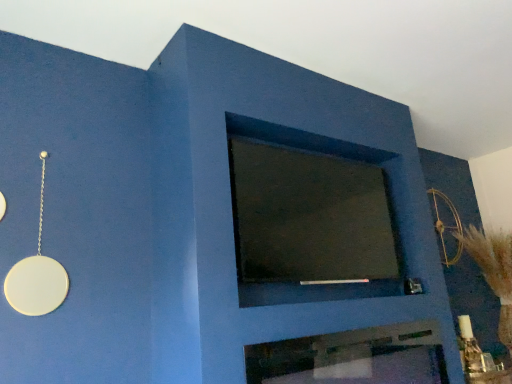
Where is `gold metallic bow at upper right`? Image resolution: width=512 pixels, height=384 pixels. gold metallic bow at upper right is located at coordinates (446, 226).

In order to click on dark matte glass at center in this screenshot , I will do `click(310, 215)`.

Considering the relative positions of dark matte glass at center and metallic silver fireplace at center in the image provided, is dark matte glass at center behind metallic silver fireplace at center?

Yes, the depth of dark matte glass at center is greater than that of metallic silver fireplace at center.

Is metallic silver fireplace at center inside dark matte glass at center?

Definitely not — metallic silver fireplace at center is not inside dark matte glass at center.

Which of these two, dark matte glass at center or metallic silver fireplace at center, stands taller?

dark matte glass at center.

From a real-world perspective, between dark matte glass at center and metallic silver fireplace at center, who is vertically lower?

→ metallic silver fireplace at center.

In the image, is gold metallic bow at upper right on the left side or the right side of dark matte glass at center?

gold metallic bow at upper right is to the right of dark matte glass at center.

Is point (444, 261) closer to camera compared to point (336, 160)?

No, (444, 261) is further to viewer.

The width and height of the screenshot is (512, 384). What are the coordinates of `circle lying on the right of dark matte glass at center` in the screenshot? It's located at 446,226.

Does gold metallic bow at upper right have a larger size compared to dark matte glass at center?

Incorrect, gold metallic bow at upper right is not larger than dark matte glass at center.

Considering the sizes of objects metallic silver fireplace at center and dark matte glass at center in the image provided, who is wider, metallic silver fireplace at center or dark matte glass at center?

dark matte glass at center.

Considering the relative sizes of metallic silver fireplace at center and dark matte glass at center in the image provided, is metallic silver fireplace at center bigger than dark matte glass at center?

Incorrect, metallic silver fireplace at center is not larger than dark matte glass at center.

From a real-world perspective, between metallic silver fireplace at center and dark matte glass at center, who is vertically higher?

In real-world perspective, dark matte glass at center is above.

Is metallic silver fireplace at center at the back of gold metallic bow at upper right?

gold metallic bow at upper right is not turned away from metallic silver fireplace at center.

Which is nearer, (454, 258) or (298, 362)?

Point (454, 258) appears to be farther away from the viewer than point (298, 362).

How many degrees apart are the facing directions of gold metallic bow at upper right and metallic silver fireplace at center?

They differ by 0.0192 degrees in their facing directions.

From a real-world perspective, is gold metallic bow at upper right below metallic silver fireplace at center?

No, from a real-world perspective, gold metallic bow at upper right is not beneath metallic silver fireplace at center.

Considering the points (341, 225) and (451, 228), which point is in front, point (341, 225) or point (451, 228)?

Positioned in front is point (341, 225).

What's the angular difference between dark matte glass at center and gold metallic bow at upper right's facing directions?

0.357 degrees separate the facing orientations of dark matte glass at center and gold metallic bow at upper right.

From the image's perspective, is dark matte glass at center beneath gold metallic bow at upper right?

No, from the image's perspective, dark matte glass at center is not beneath gold metallic bow at upper right.

The height and width of the screenshot is (384, 512). In the image, there is a gold metallic bow at upper right. Identify the location of fireplace below it (from the image's perspective). (353, 357).

Is gold metallic bow at upper right a part of metallic silver fireplace at center?

No, gold metallic bow at upper right is not a part of metallic silver fireplace at center.

How many degrees apart are the facing directions of metallic silver fireplace at center and gold metallic bow at upper right?

0.0192 degrees.

Who is more distant, metallic silver fireplace at center or gold metallic bow at upper right?

gold metallic bow at upper right is more distant.

Where is `fireplace that is in front of the dark matte glass at center`? fireplace that is in front of the dark matte glass at center is located at coordinates (353, 357).

Image resolution: width=512 pixels, height=384 pixels. In the image, there is a gold metallic bow at upper right. What are the coordinates of `window above it (from the image's perspective)` in the screenshot? It's located at (310, 215).

Consider the image. Which object lies further to the anchor point dark matte glass at center, gold metallic bow at upper right or metallic silver fireplace at center?

gold metallic bow at upper right is positioned further to the anchor dark matte glass at center.

From the image, which object appears to be nearer to metallic silver fireplace at center, dark matte glass at center or gold metallic bow at upper right?

Based on the image, dark matte glass at center appears to be nearer to metallic silver fireplace at center.

Which object lies further to the anchor point metallic silver fireplace at center, gold metallic bow at upper right or dark matte glass at center?

Among the two, gold metallic bow at upper right is located further to metallic silver fireplace at center.

Looking at the image, which one is located closer to gold metallic bow at upper right, dark matte glass at center or metallic silver fireplace at center?

The object closer to gold metallic bow at upper right is dark matte glass at center.

Which object lies further to the anchor point gold metallic bow at upper right, metallic silver fireplace at center or dark matte glass at center?

The object further to gold metallic bow at upper right is metallic silver fireplace at center.

When comparing their distances from dark matte glass at center, does metallic silver fireplace at center or gold metallic bow at upper right seem further?

Based on the image, gold metallic bow at upper right appears to be further to dark matte glass at center.

Locate an element on the screen. window located between metallic silver fireplace at center and gold metallic bow at upper right in the depth direction is located at coordinates (310, 215).